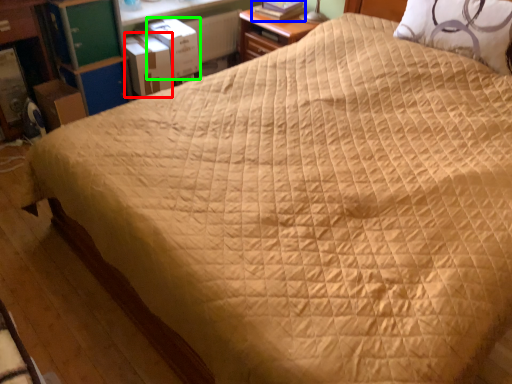
Question: Which object is positioned farthest from cardboard box (highlighted by a red box)? Select from book (highlighted by a blue box) and cardboard box (highlighted by a green box).

Choices:
 (A) book
 (B) cardboard box

Answer: (A)